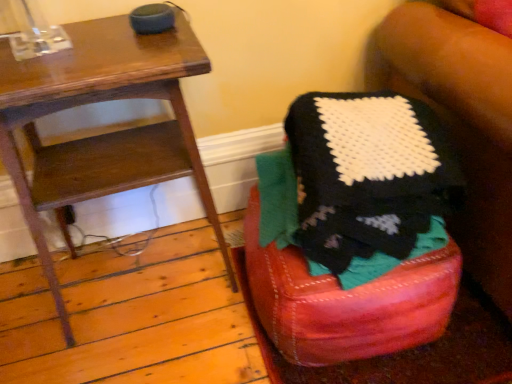
You are a GUI agent. You are given a task and a screenshot of the screen. Output one action in this format:
    pyautogui.click(x=<x>, y=<y>)
    Task: Click on the free location in front of wooden side table at left
    
    Given the screenshot: What is the action you would take?
    pyautogui.click(x=150, y=349)